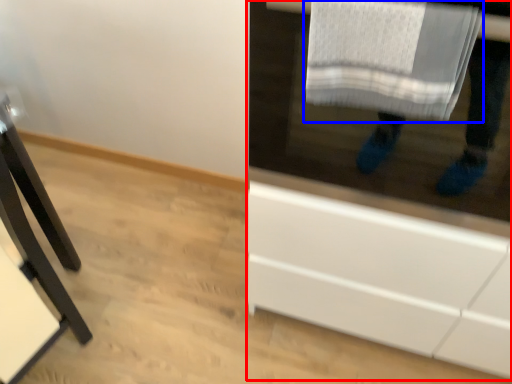
Question: Which point is closer to the camera, cabinetry (highlighted by a red box) or bath towel (highlighted by a blue box)?

Choices:
 (A) cabinetry
 (B) bath towel

Answer: (A)